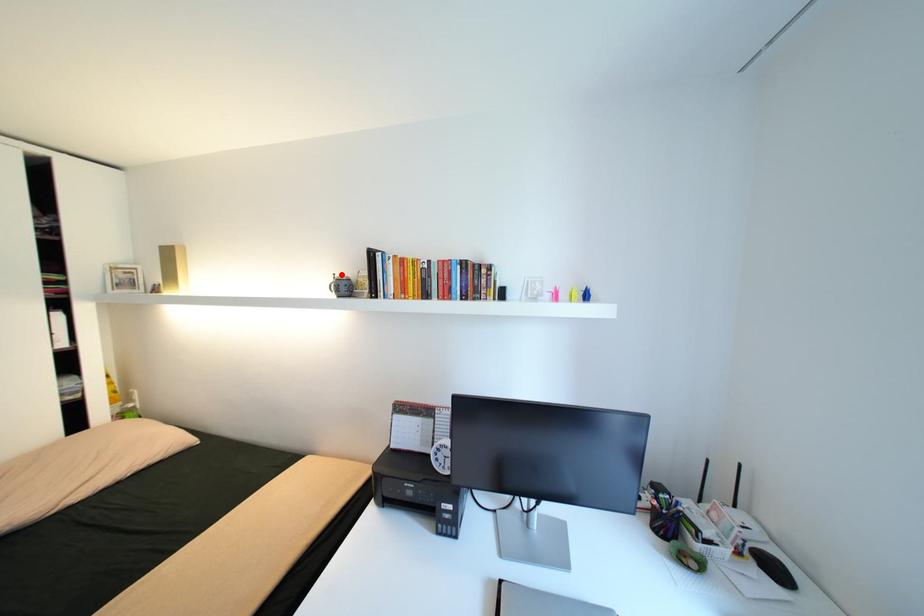
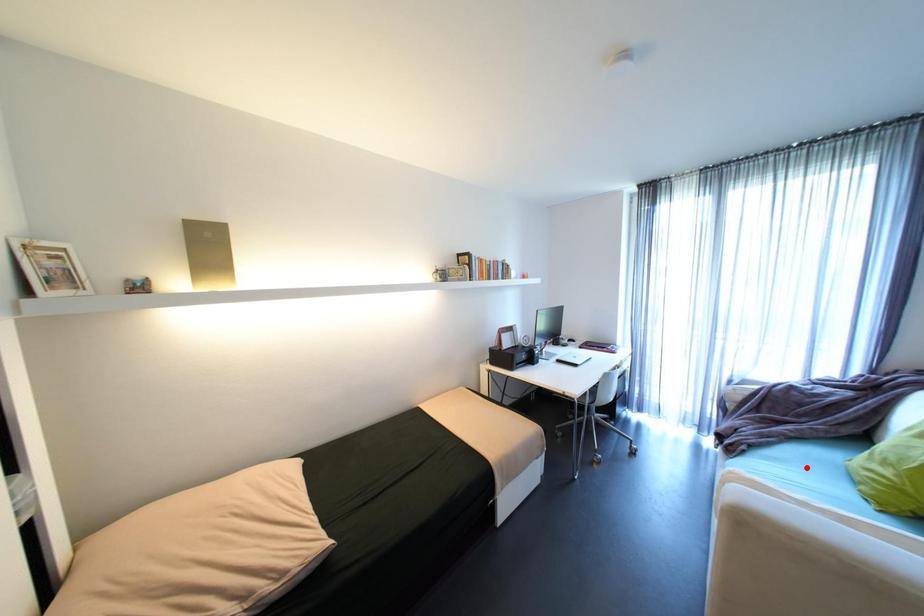
I am providing you with two images of the same scene from different viewpoints. A red point is marked on the first image and another point is marked on the second image. Does the point marked in image1 correspond to the same location as the one in image2?

No